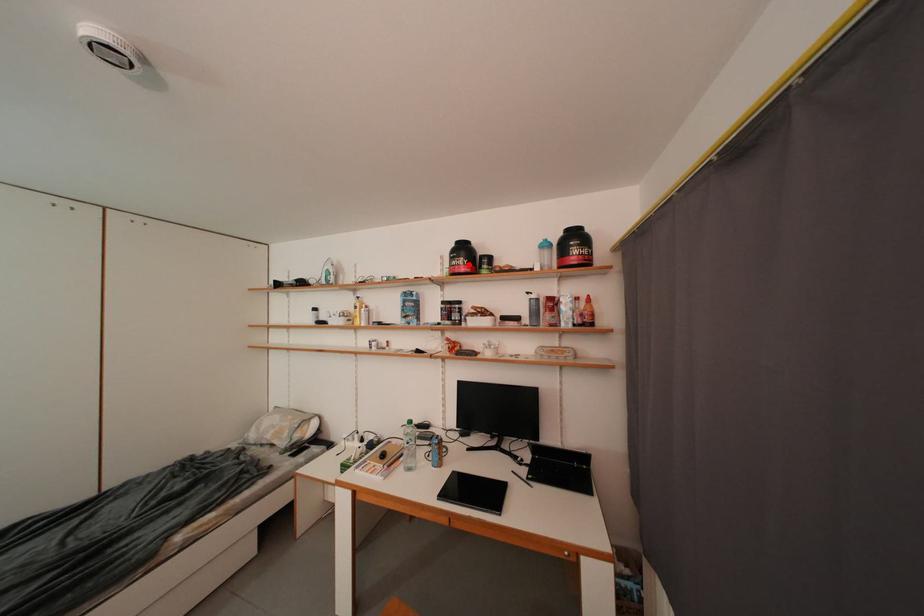
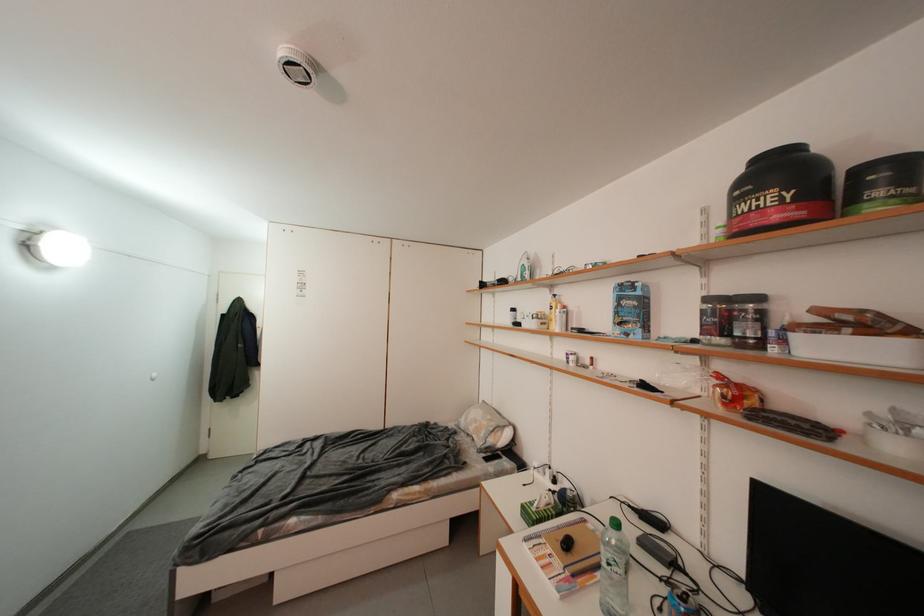
Where in the second image is the point corresponding to the highlighted location from the first image?

(776, 201)